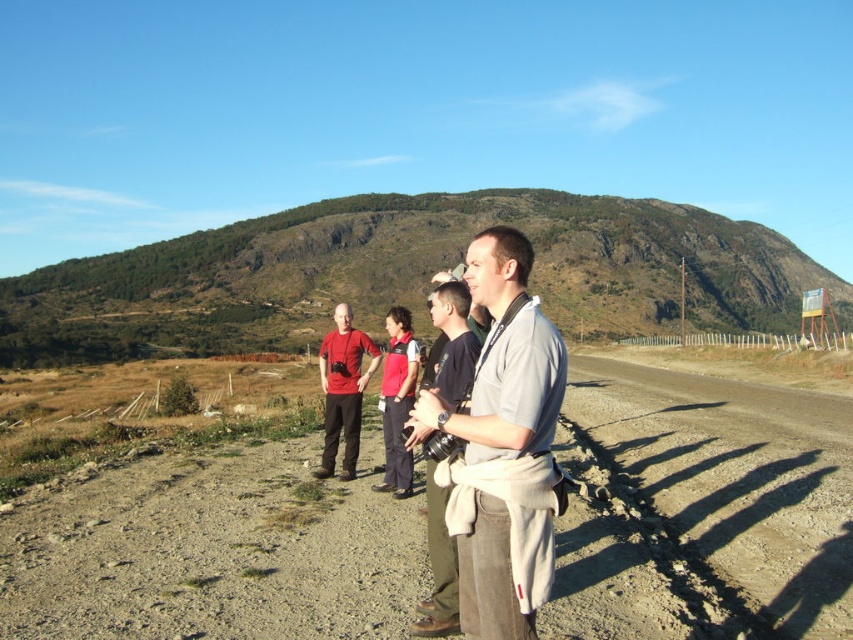
Question: In this image, where is dirt track at center located relative to matte red shirt at center?

Choices:
 (A) left
 (B) right

Answer: (B)

Question: Which point is closer to the camera?

Choices:
 (A) (x=537, y=474)
 (B) (x=433, y=573)
 (C) (x=845, y=435)

Answer: (A)

Question: Which object is closer to the camera taking this photo?

Choices:
 (A) gray cotton shirt at center
 (B) dirt track at center

Answer: (A)

Question: Does dirt track at center appear under matte red shirt at center?

Choices:
 (A) no
 (B) yes

Answer: (B)

Question: Among these objects, which one is nearest to the camera?

Choices:
 (A) dirt road at lower right
 (B) gray fabric shirt at center
 (C) gray cotton shirt at center
 (D) dirt track at center

Answer: (C)

Question: Is the position of dirt track at center less distant than that of gray cotton shirt at center?

Choices:
 (A) no
 (B) yes

Answer: (A)